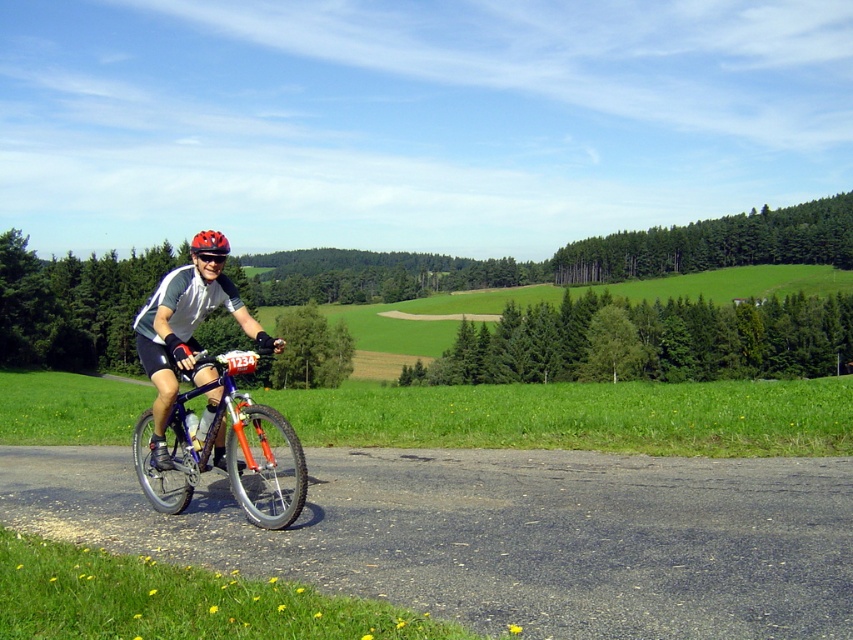
Between point (265, 451) and point (201, 230), which one is positioned in front?

Positioned in front is point (265, 451).

Who is lower down, shiny blue frame at center or orange matte bicycle helmet at upper center?

Positioned lower is shiny blue frame at center.

Who is more forward, (142, 484) or (221, 248)?

Point (221, 248) is in front.

Find the location of a particular element. The height and width of the screenshot is (640, 853). shiny blue frame at center is located at coordinates (229, 451).